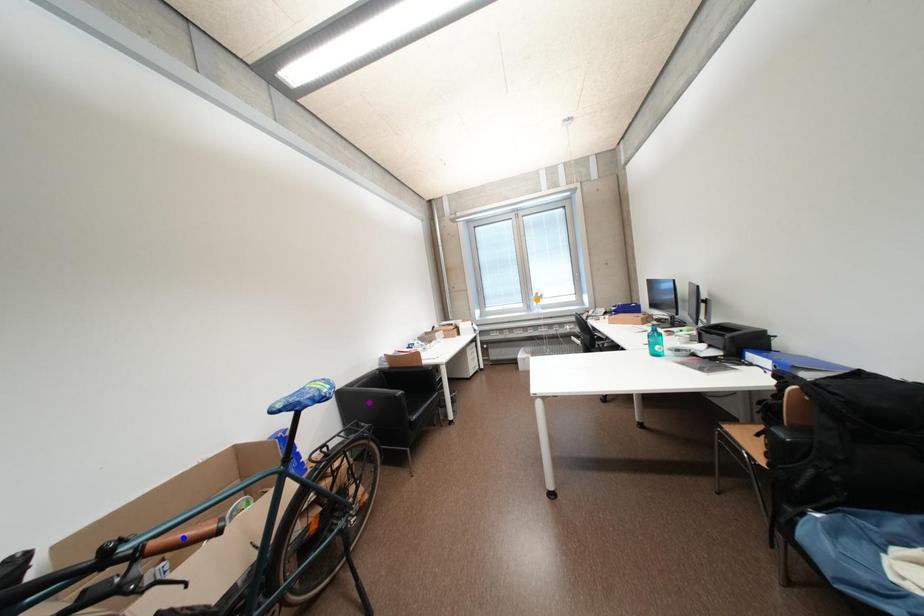
Order these from nearest to farthest:
blue point
purple point
orange point

1. blue point
2. purple point
3. orange point